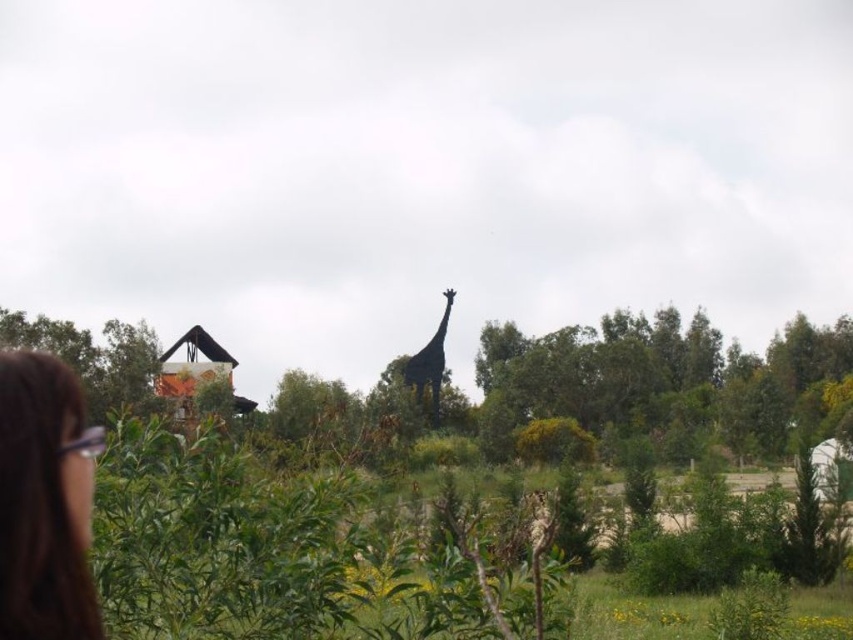
Question: Among these objects, which one is farthest from the camera?

Choices:
 (A) shiny black giraffe at center
 (B) brown hair at lower left

Answer: (A)

Question: Which point is closer to the camera?

Choices:
 (A) (440, 348)
 (B) (22, 438)

Answer: (B)

Question: Which point appears farthest from the camera in this image?

Choices:
 (A) (7, 550)
 (B) (419, 385)

Answer: (B)

Question: Does brown hair at lower left have a lesser width compared to shiny black giraffe at center?

Choices:
 (A) yes
 (B) no

Answer: (A)

Question: Is brown hair at lower left closer to the viewer compared to shiny black giraffe at center?

Choices:
 (A) yes
 (B) no

Answer: (A)

Question: Does brown hair at lower left appear over shiny black giraffe at center?

Choices:
 (A) yes
 (B) no

Answer: (A)